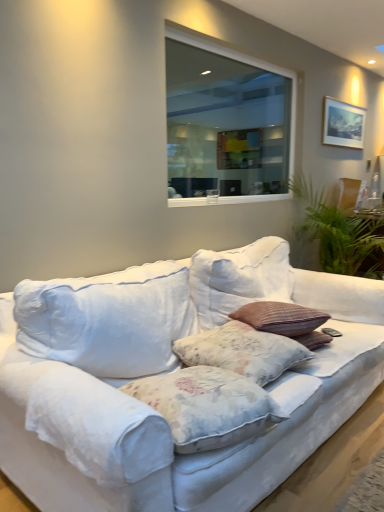
Question: Is white fabric couch at center further to camera compared to green leafy plant at right?

Choices:
 (A) yes
 (B) no

Answer: (B)

Question: Is white fabric couch at center aimed at green leafy plant at right?

Choices:
 (A) no
 (B) yes

Answer: (A)

Question: Does white fabric couch at center have a larger size compared to green leafy plant at right?

Choices:
 (A) no
 (B) yes

Answer: (B)

Question: Is white fabric couch at center positioned with its back to green leafy plant at right?

Choices:
 (A) no
 (B) yes

Answer: (A)

Question: Can you confirm if white fabric couch at center is taller than green leafy plant at right?

Choices:
 (A) no
 (B) yes

Answer: (A)

Question: Is floral fabric pillow at center, the second pillow from the front, in front of or behind floral fabric pillow at center, arranged as the first pillow when viewed from the front, in the image?

Choices:
 (A) front
 (B) behind

Answer: (B)

Question: From their relative heights in the image, would you say floral fabric pillow at center, the second pillow from the front, is taller or shorter than floral fabric pillow at center, which ranks as the second pillow in back-to-front order?

Choices:
 (A) short
 (B) tall

Answer: (A)

Question: Is floral fabric pillow at center, the second pillow from the front, bigger or smaller than floral fabric pillow at center, arranged as the first pillow when viewed from the front?

Choices:
 (A) small
 (B) big

Answer: (A)

Question: From the image's perspective, is floral fabric pillow at center, which appears as the 1th pillow when viewed from the back, located above or below floral fabric pillow at center, arranged as the first pillow when viewed from the front?

Choices:
 (A) above
 (B) below

Answer: (A)

Question: In terms of size, does green leafy plant at right appear bigger or smaller than floral fabric pillow at center, arranged as the first pillow when viewed from the front?

Choices:
 (A) big
 (B) small

Answer: (A)

Question: From the image's perspective, is green leafy plant at right above or below floral fabric pillow at center, which ranks as the second pillow in back-to-front order?

Choices:
 (A) above
 (B) below

Answer: (A)

Question: Considering the positions of point (372, 272) and point (175, 425), is point (372, 272) closer or farther from the camera than point (175, 425)?

Choices:
 (A) closer
 (B) farther

Answer: (B)

Question: Looking at their shapes, would you say green leafy plant at right is wider or thinner than floral fabric pillow at center, arranged as the first pillow when viewed from the front?

Choices:
 (A) thin
 (B) wide

Answer: (B)

Question: Which is correct: white fabric couch at center is inside green leafy plant at right, or outside of it?

Choices:
 (A) inside
 (B) outside

Answer: (B)

Question: From the image's perspective, relative to green leafy plant at right, is white fabric couch at center above or below?

Choices:
 (A) above
 (B) below

Answer: (B)